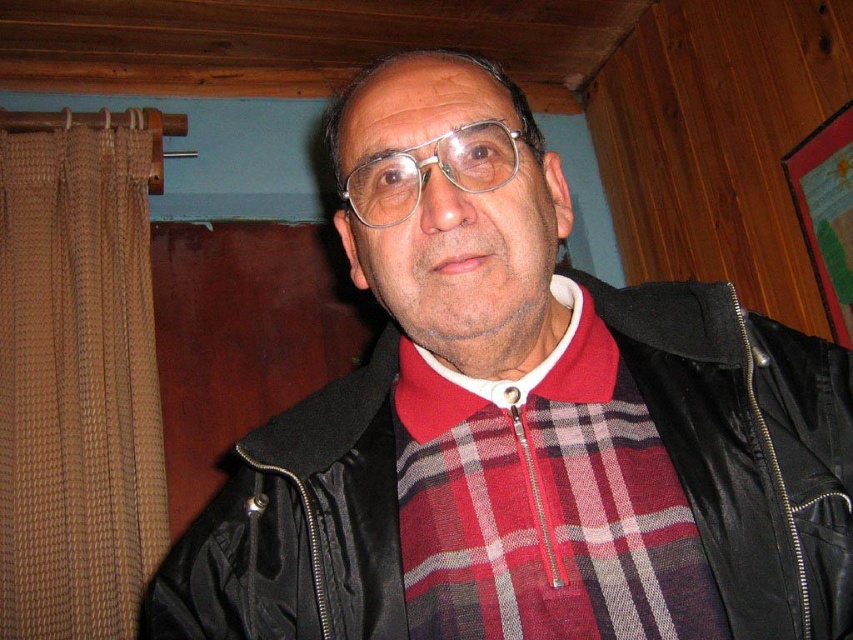
Is plaid fabric at center bigger than clear plastic glasses at center?

Yes, plaid fabric at center is bigger than clear plastic glasses at center.

Can you confirm if plaid fabric at center is positioned to the left of clear plastic glasses at center?

In fact, plaid fabric at center is to the right of clear plastic glasses at center.

Is point (490, 392) farther from viewer compared to point (485, 140)?

Yes, point (490, 392) is farther from viewer.

You are a GUI agent. You are given a task and a screenshot of the screen. Output one action in this format:
    pyautogui.click(x=<x>, y=<y>)
    Task: Click on the plaid fabric at center
    
    Given the screenshot: What is the action you would take?
    pyautogui.click(x=544, y=500)